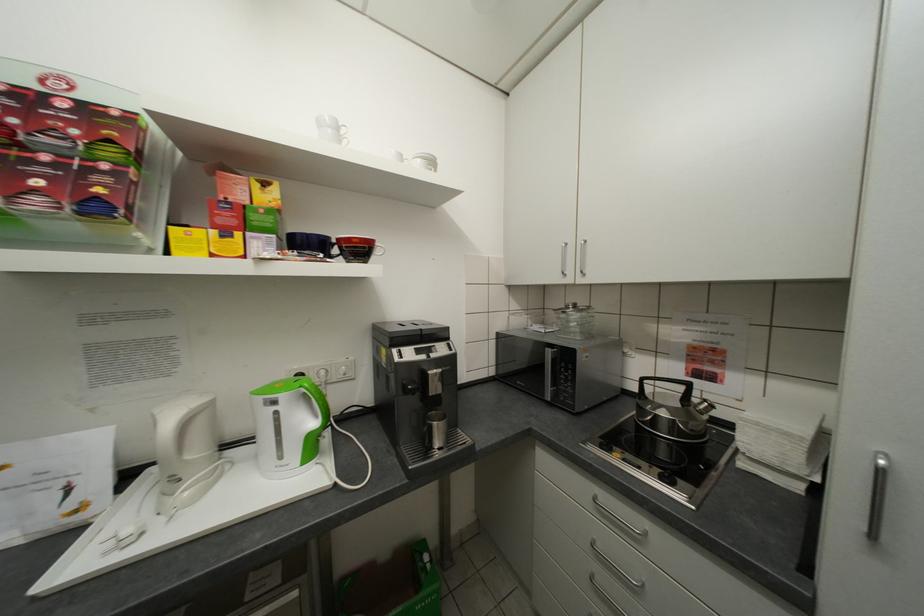
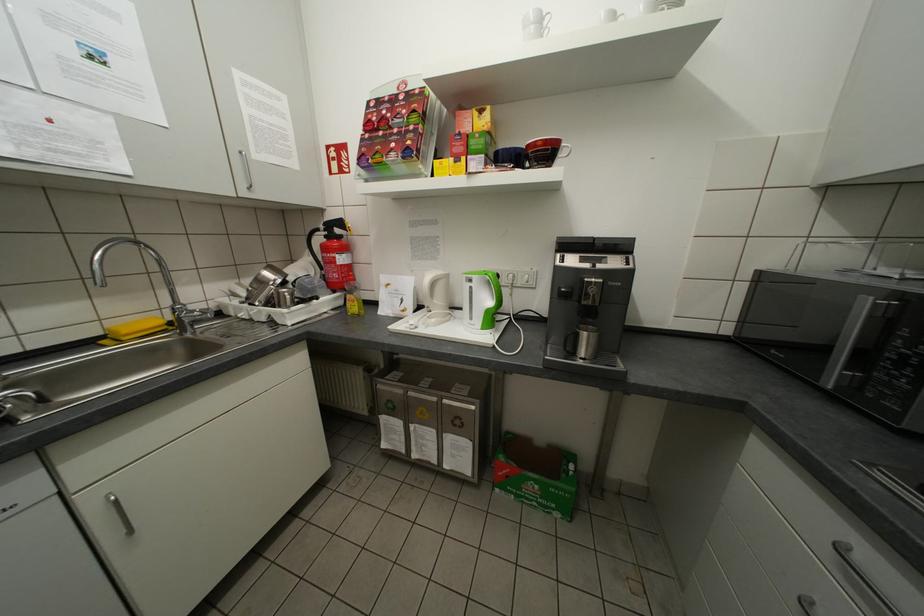
Where in the second image is the point corresponding to (x=331, y=254) from the first image?

(521, 166)